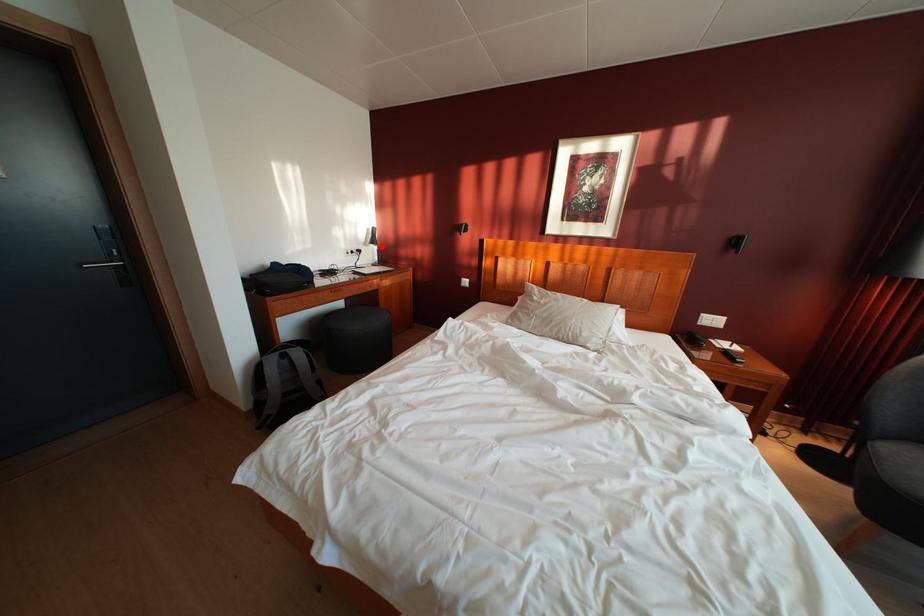
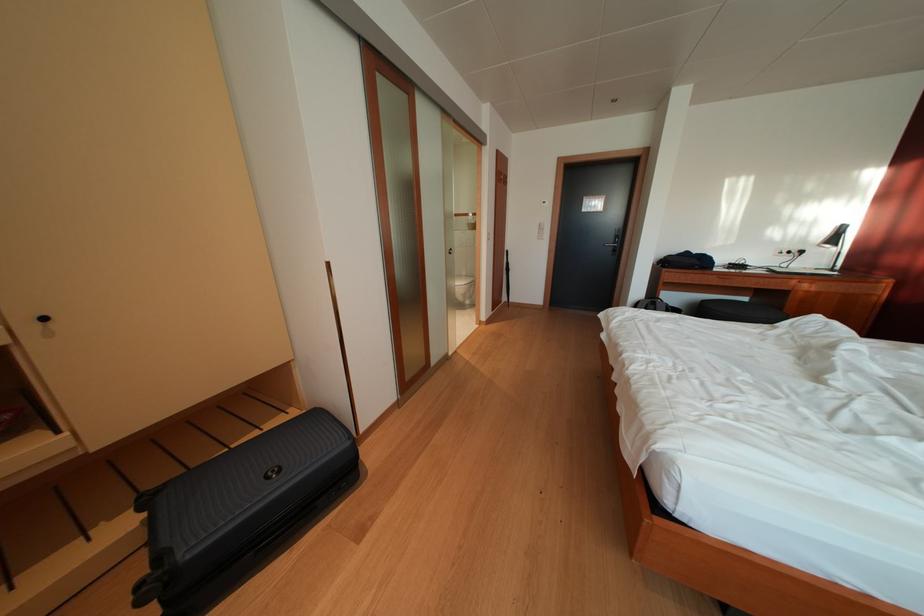
Locate, in the second image, the point that corresponds to the highlighted location in the first image.

(842, 246)